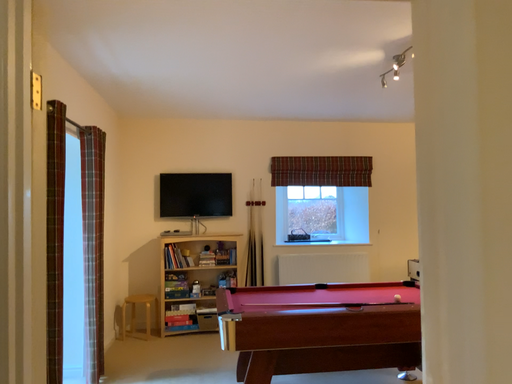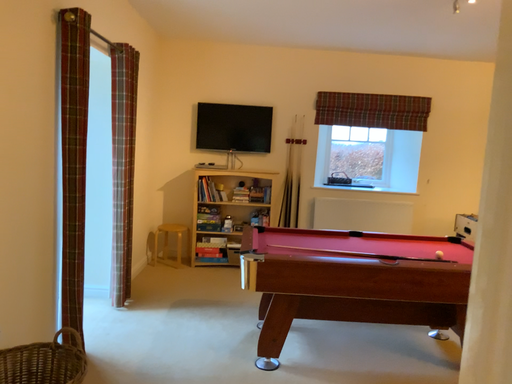
Question: How did the camera likely rotate when shooting the video?

Choices:
 (A) rotated upward
 (B) rotated downward

Answer: (B)